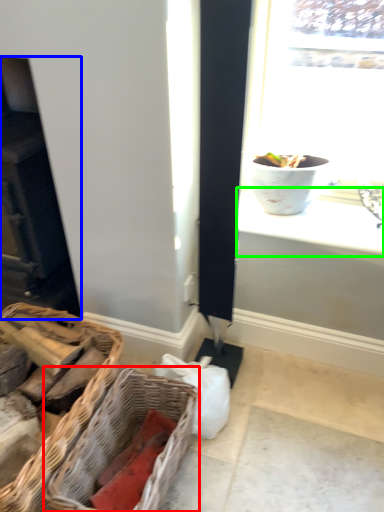
Question: Based on their relative distances, which object is nearer to picnic basket (highlighted by a red box)? Choose from fireplace (highlighted by a blue box) and window sill (highlighted by a green box).

Choices:
 (A) fireplace
 (B) window sill

Answer: (B)